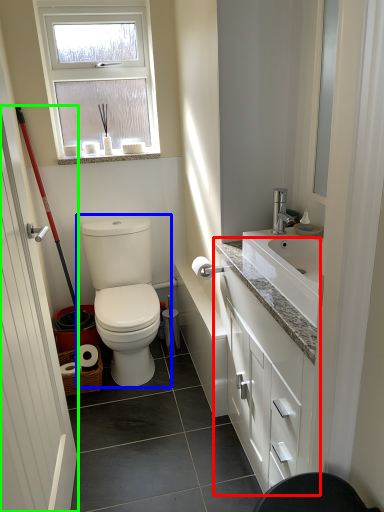
Question: Based on their relative distances, which object is farther from bathroom cabinet (highlighted by a red box)? Choose from toilet (highlighted by a blue box) and door (highlighted by a green box).

Choices:
 (A) toilet
 (B) door

Answer: (B)